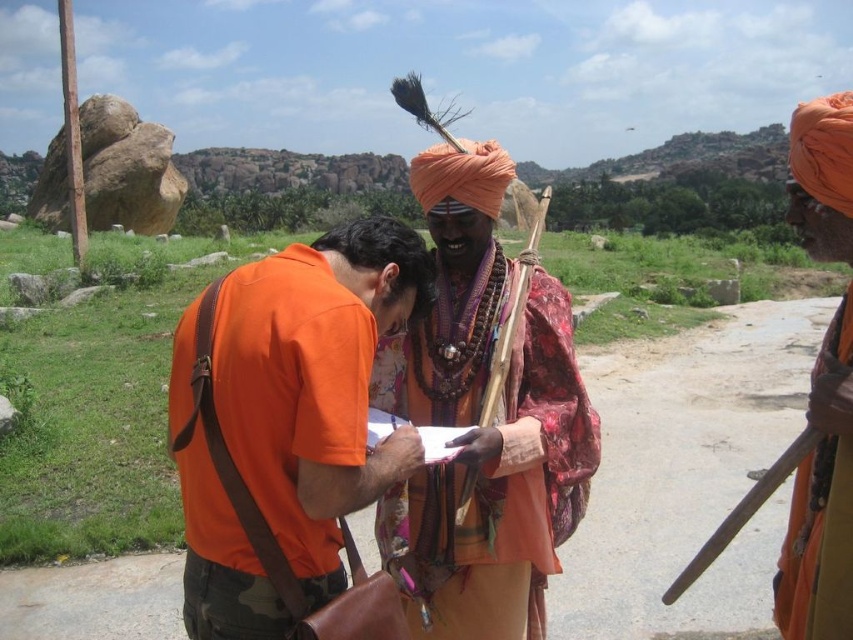
Question: Considering the relative positions of orange cotton shirt at center and textured silk robe at center in the image provided, where is orange cotton shirt at center located with respect to textured silk robe at center?

Choices:
 (A) above
 (B) below

Answer: (A)

Question: Which object is the farthest from the orange cotton shirt at center?

Choices:
 (A) orange turban at right
 (B) textured silk robe at center

Answer: (A)

Question: Does textured silk robe at center appear over orange turban at right?

Choices:
 (A) yes
 (B) no

Answer: (B)

Question: Estimate the real-world distances between objects in this image. Which object is closer to the orange turban at right?

Choices:
 (A) orange cotton shirt at center
 (B) textured silk robe at center

Answer: (A)

Question: Among these objects, which one is farthest from the camera?

Choices:
 (A) textured silk robe at center
 (B) orange turban at right

Answer: (A)

Question: Does orange cotton shirt at center come in front of orange turban at right?

Choices:
 (A) no
 (B) yes

Answer: (A)